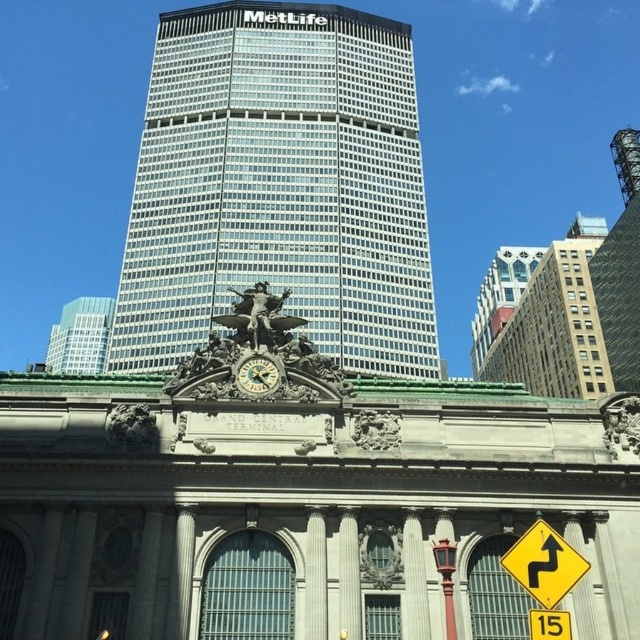
Does glassy steel skyscraper at center appear under gold metallic clock at center?

Actually, glassy steel skyscraper at center is above gold metallic clock at center.

Does glassy steel skyscraper at center appear on the right side of gold metallic clock at center?

No, glassy steel skyscraper at center is not to the right of gold metallic clock at center.

Locate an element on the screen. The image size is (640, 640). glassy steel skyscraper at center is located at coordinates (280, 186).

Is the position of brick building at upper right less distant than that of gold metallic clock at center?

No, it is not.

Is point (563, 360) behind point (268, 369)?

Yes.

Describe the element at coordinates (544, 317) in the screenshot. This screenshot has height=640, width=640. I see `brick building at upper right` at that location.

Where is `brick building at upper right`? The width and height of the screenshot is (640, 640). brick building at upper right is located at coordinates coord(544,317).

Does glassy steel skyscraper at center come in front of yellow plastic traffic sign at lower right?

No.

Between point (396, 38) and point (547, 556), which one is positioned in front?

Point (547, 556)

Is point (205, 244) farther from viewer compared to point (536, 532)?

Yes.

Identify the location of glassy steel skyscraper at center. The image size is (640, 640). (280, 186).